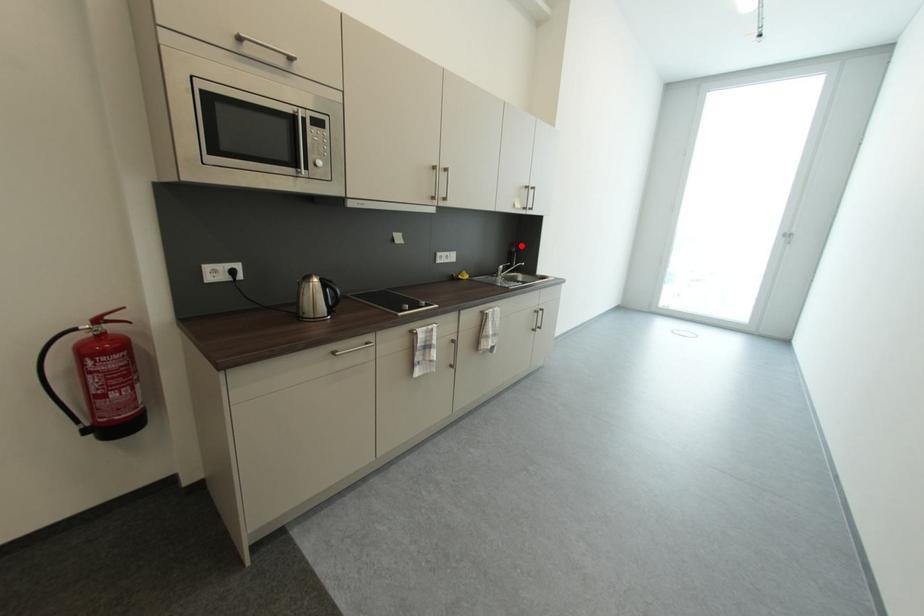
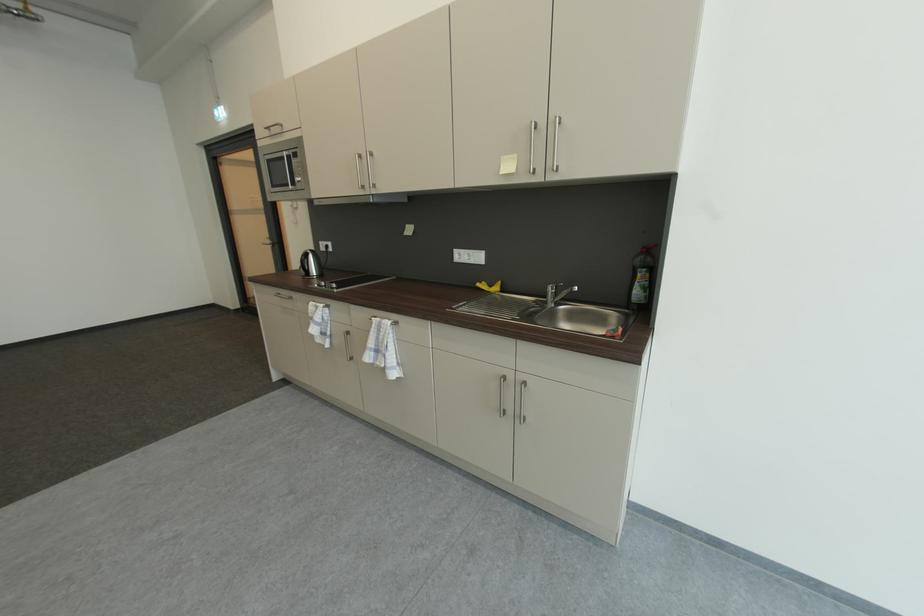
Question: I am providing you with two images of the same scene from different viewpoints. Image1 has a red point marked. In image2, the corresponding 3D location appears at what relative position? Reply with the corresponding letter.

Choices:
 (A) Closer
 (B) Farther

Answer: (B)